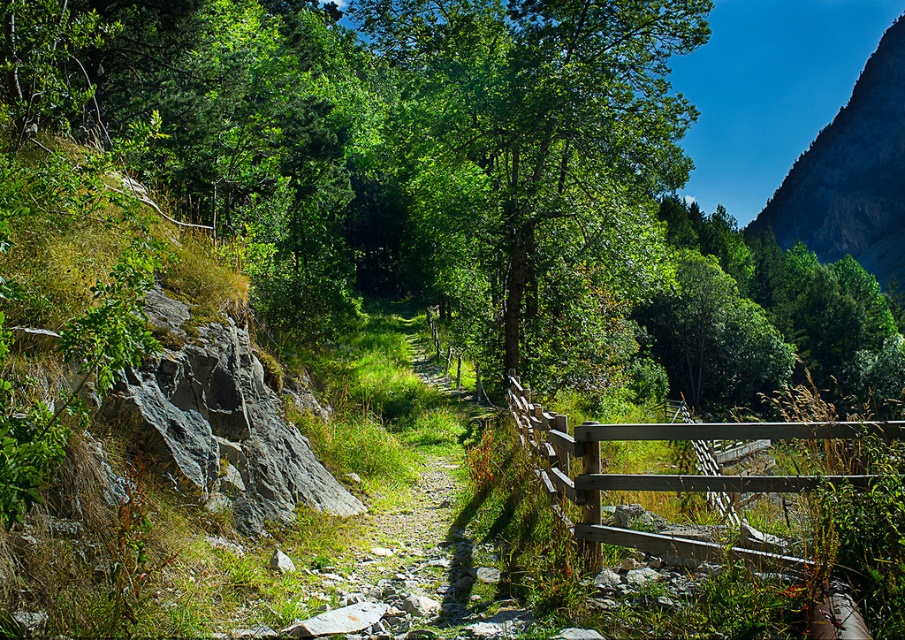
You are a hiker carrying a large backpack and want to pass through the wooden gate at center. The green leafy tree at center is blocking part of the path. Can you estimate if there is enough space to walk through the gate without touching the tree?

The green leafy tree at center might be wider than wooden gate at center, so there might not be enough space to pass through without touching the tree. It is recommended to check the width before proceeding.

You are standing at the starting point of the path and want to reach the green leafy tree at center. Which direction should you walk to get closer to the tree?

The green leafy tree at center is located at point (539, 164), so you should walk forward along the path towards the center of the image to reach it.